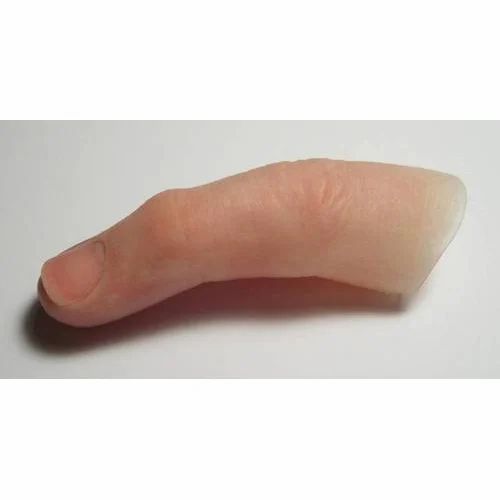
This screenshot has height=500, width=500. Identify the location of white surface. (81, 158).